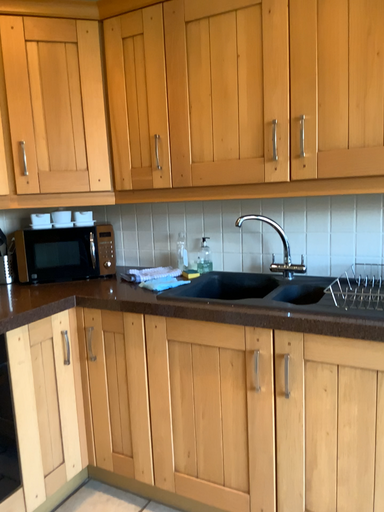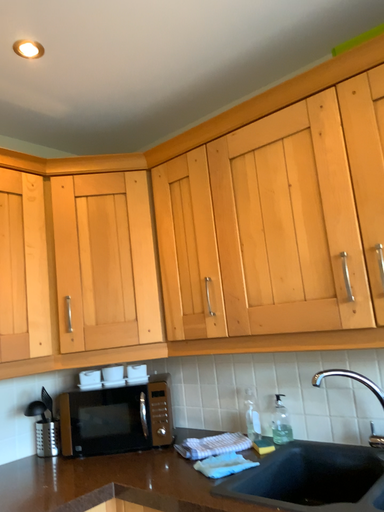
Question: How did the camera likely rotate when shooting the video?

Choices:
 (A) rotated downward
 (B) rotated upward

Answer: (B)